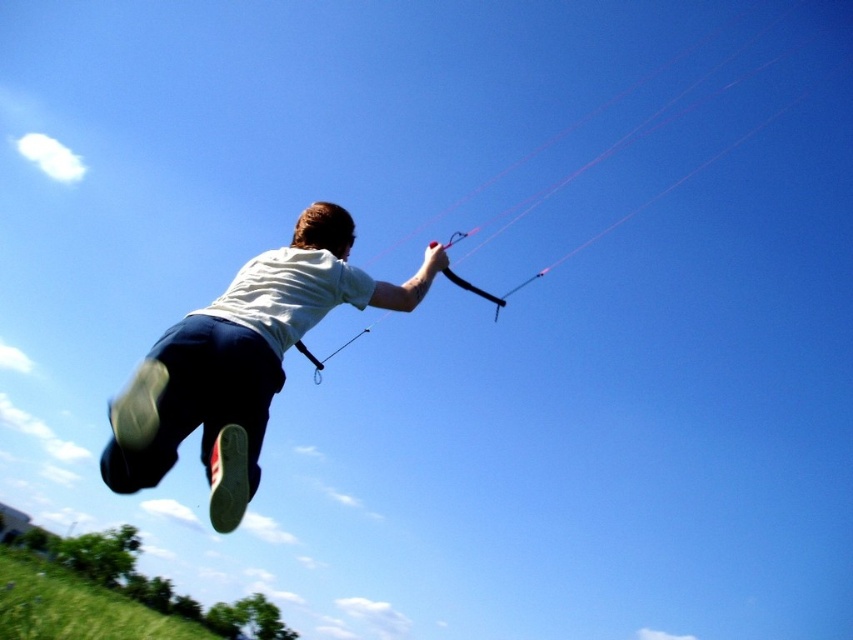
Question: Estimate the real-world distances between objects in this image. Which object is closer to the white cotton shirt at center?

Choices:
 (A) black matte parachute at upper center
 (B) green grassy hillside at lower left

Answer: (A)

Question: Observing the image, what is the correct spatial positioning of white cotton shirt at center in reference to green grassy hillside at lower left?

Choices:
 (A) above
 (B) below

Answer: (A)

Question: From the image, what is the correct spatial relationship of green grassy hillside at lower left in relation to black matte parachute at upper center?

Choices:
 (A) below
 (B) above

Answer: (A)

Question: In this image, where is green grassy hillside at lower left located relative to black matte parachute at upper center?

Choices:
 (A) right
 (B) left

Answer: (B)

Question: Which point is farther to the camera?

Choices:
 (A) green grassy hillside at lower left
 (B) black matte parachute at upper center

Answer: (A)

Question: Based on their relative distances, which object is farther from the white cotton shirt at center?

Choices:
 (A) black matte parachute at upper center
 (B) green grassy hillside at lower left

Answer: (B)